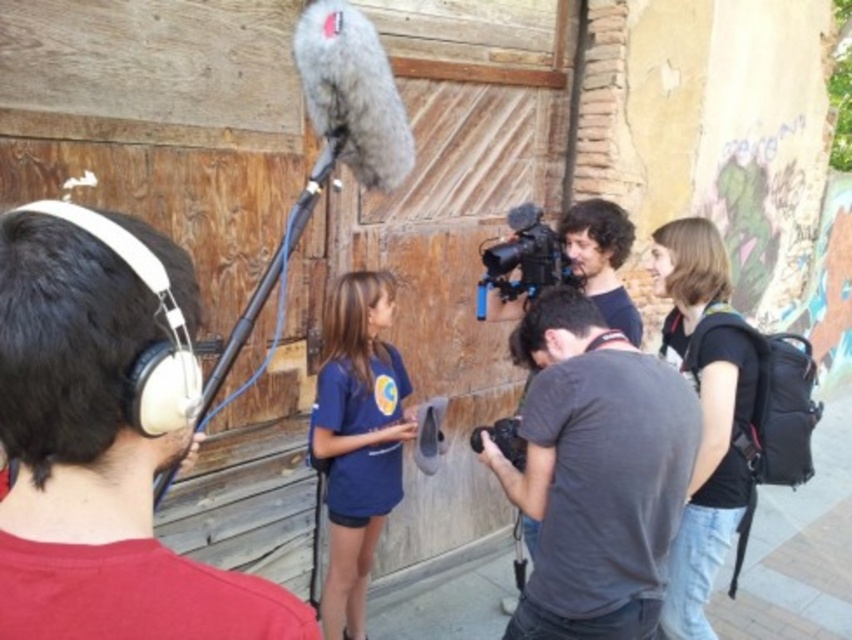
Question: Which point appears closest to the camera in this image?

Choices:
 (A) (213, 394)
 (B) (657, 253)

Answer: (A)

Question: Is blue cotton shirt at center bigger than black matte video camera at center?

Choices:
 (A) no
 (B) yes

Answer: (B)

Question: Among these objects, which one is farthest from the camera?

Choices:
 (A) black matte video camera at center
 (B) blue cotton shirt at center

Answer: (A)

Question: From the image, what is the correct spatial relationship of blue cotton shirt at center in relation to matte black microphone boom at upper center?

Choices:
 (A) left
 (B) right

Answer: (B)

Question: Does blue cotton shirt at center have a smaller size compared to black matte video camera at center?

Choices:
 (A) yes
 (B) no

Answer: (B)

Question: Among these objects, which one is farthest from the camera?

Choices:
 (A) blue cotton shirt at center
 (B) matte black microphone boom at upper center

Answer: (A)